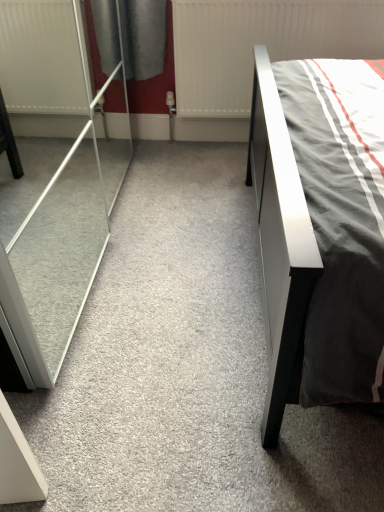
Question: From the image's perspective, is white textured radiator at upper center located above or below transparent glass screen door at left?

Choices:
 (A) above
 (B) below

Answer: (A)

Question: In terms of height, does white textured radiator at upper center look taller or shorter compared to transparent glass screen door at left?

Choices:
 (A) short
 (B) tall

Answer: (A)

Question: Would you say white textured radiator at upper center is inside or outside transparent glass screen door at left?

Choices:
 (A) inside
 (B) outside

Answer: (B)

Question: From a real-world perspective, relative to white textured radiator at upper center, is transparent glass screen door at left vertically above or below?

Choices:
 (A) above
 (B) below

Answer: (A)

Question: From their relative heights in the image, would you say transparent glass screen door at left is taller or shorter than white textured radiator at upper center?

Choices:
 (A) tall
 (B) short

Answer: (A)

Question: In terms of width, does transparent glass screen door at left look wider or thinner when compared to white textured radiator at upper center?

Choices:
 (A) thin
 (B) wide

Answer: (B)

Question: From the image's perspective, is transparent glass screen door at left above or below white textured radiator at upper center?

Choices:
 (A) below
 (B) above

Answer: (A)